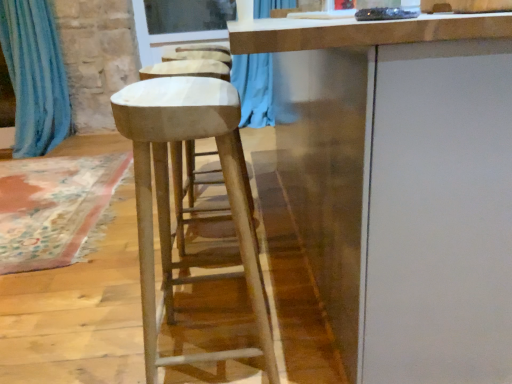
This screenshot has width=512, height=384. Find the location of `blue fabric curtain at left`. blue fabric curtain at left is located at coordinates (35, 76).

At what (x,y) coordinates should I click in order to perform the action: click on transparent glass window screen at upper center. Please return your answer as a coordinate pair (x, y). The height and width of the screenshot is (384, 512). Looking at the image, I should click on (188, 15).

In order to face smooth white stool at center, should I rotate leftwards or rightwards?

Turn left approximately 7.103 degrees to face it.

What are the coordinates of `white matte cabinet at center` in the screenshot? It's located at (401, 185).

This screenshot has width=512, height=384. Find the location of `blue fabric curtain at left`. blue fabric curtain at left is located at coordinates (35, 76).

Based on the photo, in terms of height, does transparent glass window screen at upper center look taller or shorter compared to blue fabric curtain at left?

Clearly, transparent glass window screen at upper center is shorter compared to blue fabric curtain at left.

Based on the photo, how different are the orientations of transparent glass window screen at upper center and blue fabric curtain at left in degrees?

transparent glass window screen at upper center and blue fabric curtain at left are facing 0.984 degrees away from each other.

Considering the sizes of transparent glass window screen at upper center and blue fabric curtain at left in the image, is transparent glass window screen at upper center bigger or smaller than blue fabric curtain at left?

Clearly, transparent glass window screen at upper center is smaller in size than blue fabric curtain at left.

Is transparent glass window screen at upper center turned away from blue fabric curtain at left?

No, transparent glass window screen at upper center is not facing away from blue fabric curtain at left.

Considering the relative positions of smooth white stool at center and transparent glass window screen at upper center in the image provided, is smooth white stool at center to the right of transparent glass window screen at upper center from the viewer's perspective?

Yes, smooth white stool at center is to the right of transparent glass window screen at upper center.

Is smooth white stool at center shorter than transparent glass window screen at upper center?

No, smooth white stool at center is not shorter than transparent glass window screen at upper center.

Based on the photo, between smooth white stool at center and transparent glass window screen at upper center, which one is positioned in front?

smooth white stool at center is in front.

Choose the correct answer: Is smooth white stool at center inside transparent glass window screen at upper center or outside it?

smooth white stool at center is not enclosed by transparent glass window screen at upper center.

From a real-world perspective, which object rests below the other?

From a 3D spatial view, white matte cabinet at center is below.

Is blue fabric curtain at left positioned beyond the bounds of white matte cabinet at center?

Indeed, blue fabric curtain at left is completely outside white matte cabinet at center.

Does blue fabric curtain at left appear on the right side of white matte cabinet at center?

In fact, blue fabric curtain at left is to the left of white matte cabinet at center.

Which is further, (x=50, y=63) or (x=490, y=163)?

Positioned behind is point (x=50, y=63).

Is blue fabric curtain at left looking in the opposite direction of smooth white stool at center?

No, blue fabric curtain at left's orientation is not away from smooth white stool at center.

In order to click on stool on the right of the blue fabric curtain at left in this screenshot , I will do click(169, 200).

From the picture: From the image's perspective, which one is positioned higher, blue fabric curtain at left or smooth white stool at center?

blue fabric curtain at left is shown above in the image.

Between blue fabric curtain at left and smooth white stool at center, which one has more height?

blue fabric curtain at left is taller.

How distant is blue fabric curtain at left from transparent glass window screen at upper center?

The distance of blue fabric curtain at left from transparent glass window screen at upper center is 1.16 meters.

Between point (41, 14) and point (155, 18), which one is positioned in front?

The point (41, 14) is closer to the camera.

Between blue fabric curtain at left and transparent glass window screen at upper center, which one has smaller size?

transparent glass window screen at upper center is smaller.

Is blue fabric curtain at left far from transparent glass window screen at upper center?

Yes, blue fabric curtain at left and transparent glass window screen at upper center are quite far apart.

Is white matte cabinet at center inside or outside of smooth white stool at center?

The correct answer is: outside.

Is white matte cabinet at center oriented towards smooth white stool at center?

Yes, white matte cabinet at center is aimed at smooth white stool at center.

Which is in front, white matte cabinet at center or smooth white stool at center?

white matte cabinet at center.

Which object is thinner, transparent glass window screen at upper center or white matte cabinet at center?

With smaller width is transparent glass window screen at upper center.

Considering the sizes of transparent glass window screen at upper center and white matte cabinet at center in the image, is transparent glass window screen at upper center taller or shorter than white matte cabinet at center?

transparent glass window screen at upper center is shorter than white matte cabinet at center.

At what (x,y) coordinates should I click in order to perform the action: click on cabinetry below the transparent glass window screen at upper center (from a real-world perspective). Please return your answer as a coordinate pair (x, y). This screenshot has height=384, width=512. Looking at the image, I should click on (401, 185).

Is the depth of transparent glass window screen at upper center greater than that of white matte cabinet at center?

Yes, transparent glass window screen at upper center is behind white matte cabinet at center.

I want to click on window screen behind the blue fabric curtain at left, so click(x=188, y=15).

Locate an element on the screen. The height and width of the screenshot is (384, 512). stool that appears below the transparent glass window screen at upper center (from a real-world perspective) is located at coordinates (169, 200).

Estimate the real-world distances between objects in this image. Which object is closer to smooth white stool at center, transparent glass window screen at upper center or white matte cabinet at center?

The object closer to smooth white stool at center is white matte cabinet at center.

Based on their spatial positions, is blue fabric curtain at left or smooth white stool at center closer to white matte cabinet at center?

The object closer to white matte cabinet at center is smooth white stool at center.

Which object lies nearer to the anchor point transparent glass window screen at upper center, smooth white stool at center or blue fabric curtain at left?

blue fabric curtain at left is closer to transparent glass window screen at upper center.

Looking at the image, which one is located closer to white matte cabinet at center, transparent glass window screen at upper center or blue fabric curtain at left?

The object closer to white matte cabinet at center is blue fabric curtain at left.

Based on their spatial positions, is white matte cabinet at center or smooth white stool at center further from blue fabric curtain at left?

Based on the image, white matte cabinet at center appears to be further to blue fabric curtain at left.

Which object lies further to the anchor point blue fabric curtain at left, transparent glass window screen at upper center or white matte cabinet at center?

Based on the image, white matte cabinet at center appears to be further to blue fabric curtain at left.

Considering their positions, is blue fabric curtain at left positioned closer to transparent glass window screen at upper center than white matte cabinet at center?

blue fabric curtain at left.

Considering their positions, is smooth white stool at center positioned further to white matte cabinet at center than blue fabric curtain at left?

blue fabric curtain at left is positioned further to the anchor white matte cabinet at center.

Identify the location of stool positioned between white matte cabinet at center and transparent glass window screen at upper center from near to far. The height and width of the screenshot is (384, 512). tap(169, 200).

Where is `stool between white matte cabinet at center and blue fabric curtain at left in the front-back direction`? This screenshot has height=384, width=512. stool between white matte cabinet at center and blue fabric curtain at left in the front-back direction is located at coordinates (169, 200).

Locate an element on the screen. The image size is (512, 384). curtain between smooth white stool at center and transparent glass window screen at upper center along the z-axis is located at coordinates (35, 76).

Find the location of a particular element. Image resolution: width=512 pixels, height=384 pixels. curtain located between white matte cabinet at center and transparent glass window screen at upper center in the depth direction is located at coordinates (35, 76).